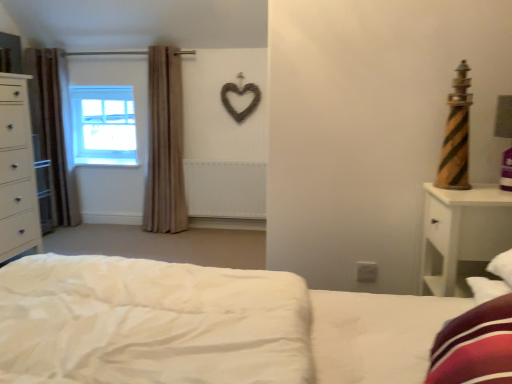
Question: From a real-world perspective, is beige fabric curtain at left, which ranks as the 1th curtain in right-to-left order, below brown fabric curtain at left, which appears as the second curtain when viewed from the right?

Choices:
 (A) no
 (B) yes

Answer: (B)

Question: Is brown fabric curtain at left, acting as the 1th curtain starting from the left, a part of beige fabric curtain at left, the second curtain positioned from the left?

Choices:
 (A) no
 (B) yes

Answer: (A)

Question: From the image's perspective, is beige fabric curtain at left, the second curtain positioned from the left, on brown fabric curtain at left, acting as the 1th curtain starting from the left?

Choices:
 (A) no
 (B) yes

Answer: (A)

Question: From a real-world perspective, is beige fabric curtain at left, the second curtain positioned from the left, over brown fabric curtain at left, acting as the 1th curtain starting from the left?

Choices:
 (A) yes
 (B) no

Answer: (B)

Question: Is beige fabric curtain at left, the second curtain positioned from the left, at the left side of brown fabric curtain at left, which appears as the second curtain when viewed from the right?

Choices:
 (A) yes
 (B) no

Answer: (B)

Question: In terms of width, does clear glass window at upper left look wider or thinner when compared to white matte radiator at center?

Choices:
 (A) wide
 (B) thin

Answer: (A)

Question: From a real-world perspective, is clear glass window at upper left above or below white matte radiator at center?

Choices:
 (A) above
 (B) below

Answer: (A)

Question: Is clear glass window at upper left taller or shorter than white matte radiator at center?

Choices:
 (A) short
 (B) tall

Answer: (B)

Question: Is clear glass window at upper left inside the boundaries of white matte radiator at center, or outside?

Choices:
 (A) inside
 (B) outside

Answer: (B)

Question: From a real-world perspective, is white glossy chest of drawers at left above or below brown fabric curtain at left, which appears as the second curtain when viewed from the right?

Choices:
 (A) below
 (B) above

Answer: (A)

Question: Is point (8, 203) positioned closer to the camera than point (50, 87)?

Choices:
 (A) closer
 (B) farther

Answer: (A)

Question: In the image, is white glossy chest of drawers at left positioned in front of or behind brown fabric curtain at left, acting as the 1th curtain starting from the left?

Choices:
 (A) behind
 (B) front

Answer: (B)

Question: Based on their positions, is white glossy chest of drawers at left located to the left or right of brown fabric curtain at left, which appears as the second curtain when viewed from the right?

Choices:
 (A) right
 (B) left

Answer: (A)

Question: Relative to brown fabric curtain at left, acting as the 1th curtain starting from the left, is white wood nightstand at right in front or behind?

Choices:
 (A) front
 (B) behind

Answer: (A)

Question: Is white wood nightstand at right wider or thinner than brown fabric curtain at left, acting as the 1th curtain starting from the left?

Choices:
 (A) thin
 (B) wide

Answer: (B)